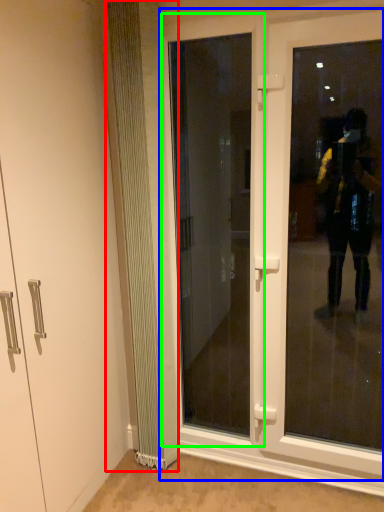
Question: Which object is positioned closest to radiator (highlighted by a red box)? Select from door (highlighted by a blue box) and door (highlighted by a green box).

Choices:
 (A) door
 (B) door

Answer: (A)